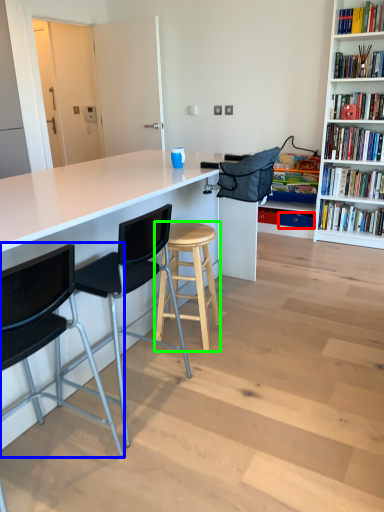
Question: Considering the real-world distances, which object is farthest from drawer (highlighted by a red box)? chair (highlighted by a blue box) or stool (highlighted by a green box)?

Choices:
 (A) chair
 (B) stool

Answer: (A)